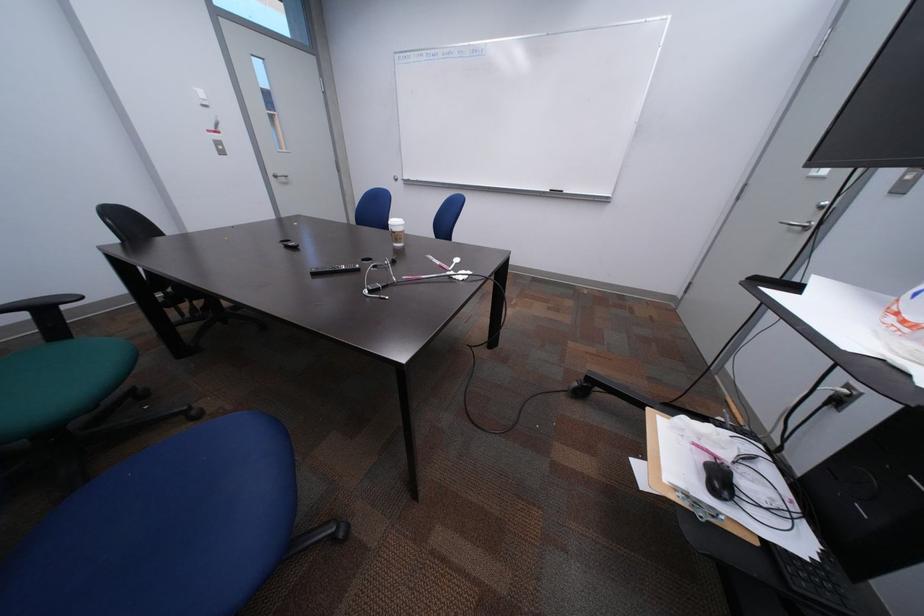
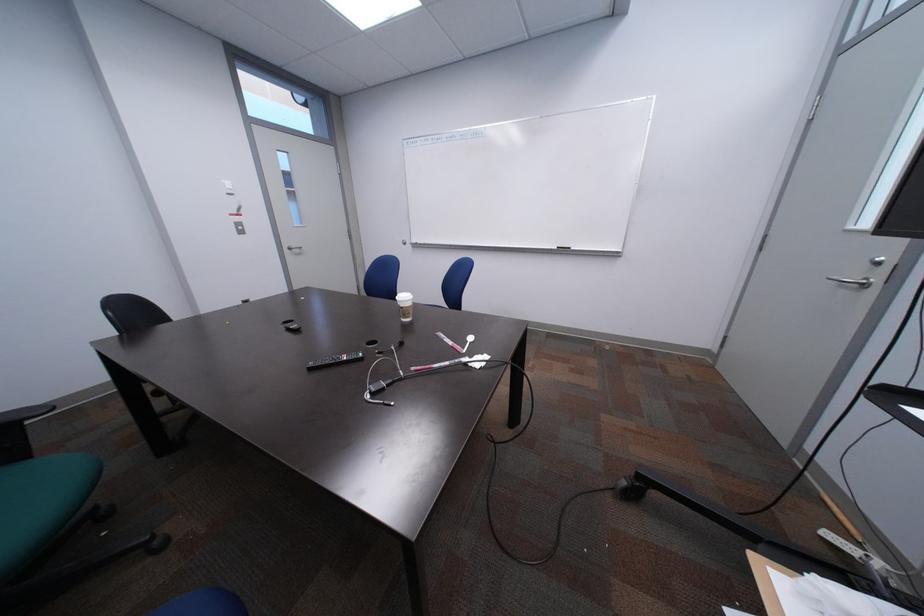
Question: How did the camera likely rotate?

Choices:
 (A) Left
 (B) Right
 (C) Up
 (D) Down

Answer: (C)